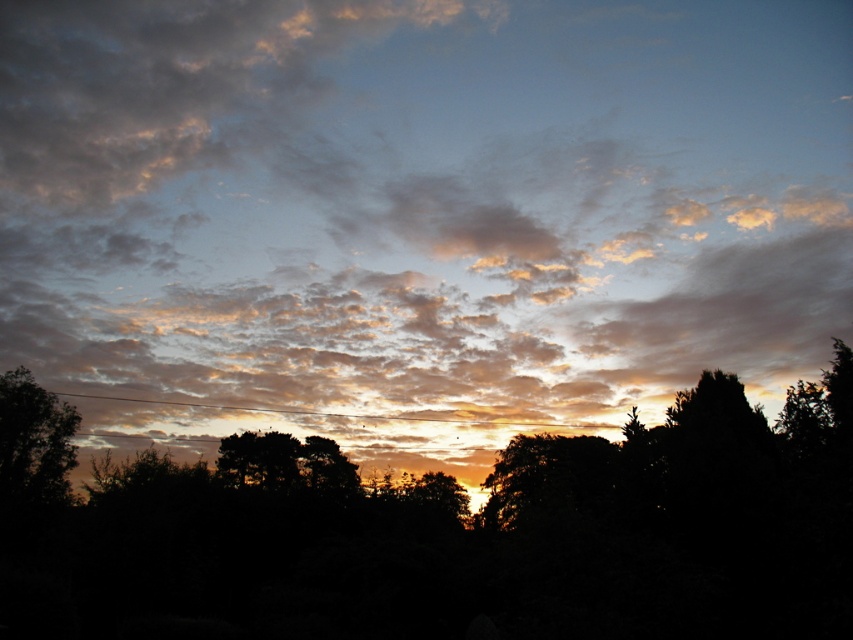
Does cloudy sky at center have a greater height compared to silhouette tree at center?

Yes, cloudy sky at center is taller than silhouette tree at center.

Looking at this image, who is higher up, cloudy sky at center or silhouette tree at center?

cloudy sky at center is higher up.

Is point (235, 4) positioned in front of point (55, 515)?

No.

The image size is (853, 640). In order to click on cloudy sky at center in this screenshot , I will do `click(419, 212)`.

Is point (706, 72) farther from camera compared to point (0, 490)?

Yes.

Is cloudy sky at center closer to the viewer compared to dark green leafy tree at lower left?

Yes, it is.

The image size is (853, 640). What do you see at coordinates (419, 212) in the screenshot?
I see `cloudy sky at center` at bounding box center [419, 212].

This screenshot has height=640, width=853. Identify the location of cloudy sky at center. (419, 212).

Which is in front, point (492, 515) or point (57, 461)?

Point (57, 461) is in front.

Can you confirm if silhouette tree at center is shorter than dark green leafy tree at lower left?

No.

Between point (428, 486) and point (27, 483), which one is positioned behind?

The point (428, 486) is behind.

In order to click on silhouette tree at center in this screenshot , I will do `click(466, 536)`.